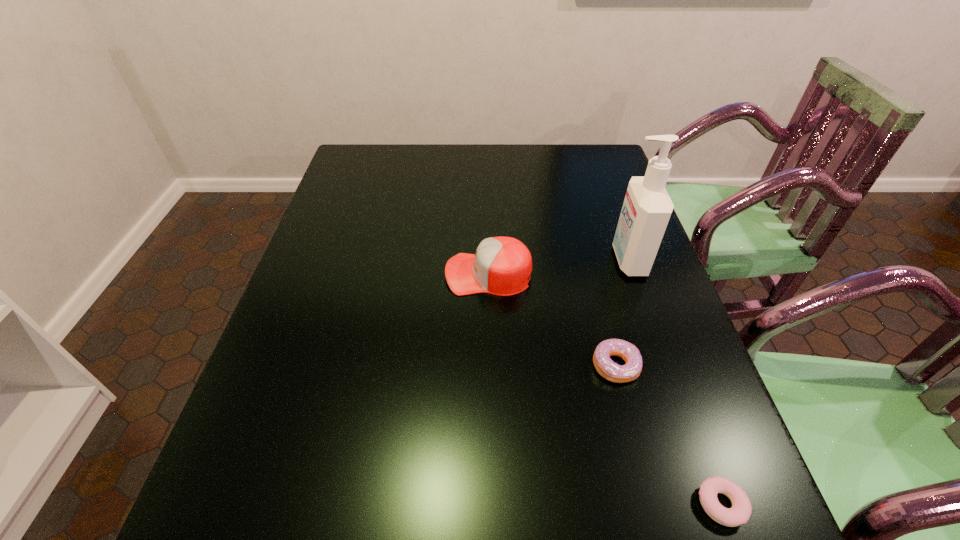
Where is `vacant area at the left edge`? Image resolution: width=960 pixels, height=540 pixels. vacant area at the left edge is located at coordinates (307, 296).

This screenshot has height=540, width=960. In order to click on free region at the right edge of the desktop in this screenshot , I will do `click(601, 185)`.

The width and height of the screenshot is (960, 540). I want to click on free space at the far right corner of the desktop, so click(x=607, y=163).

Where is `free area in between the third shortest object and the third tallest object`? The width and height of the screenshot is (960, 540). free area in between the third shortest object and the third tallest object is located at coordinates (552, 320).

Find the location of a particular element. The width and height of the screenshot is (960, 540). free area in between the third tallest object and the leftmost object is located at coordinates (552, 320).

Identify the location of unoccupied area between the shorter doughnut and the second shortest object. (668, 435).

At what (x,y) coordinates should I click in order to perform the action: click on free spot between the second nearest object and the cleansing agent. Please return your answer as a coordinate pair (x, y). The width and height of the screenshot is (960, 540). Looking at the image, I should click on (622, 313).

Where is `free space between the third farthest object and the leftmost object`? free space between the third farthest object and the leftmost object is located at coordinates (552, 320).

The height and width of the screenshot is (540, 960). In order to click on vacant region between the shortest object and the tallest object in this screenshot , I will do `click(674, 382)`.

Locate an element on the screen. The width and height of the screenshot is (960, 540). unoccupied area between the third tallest object and the third shortest object is located at coordinates (552, 320).